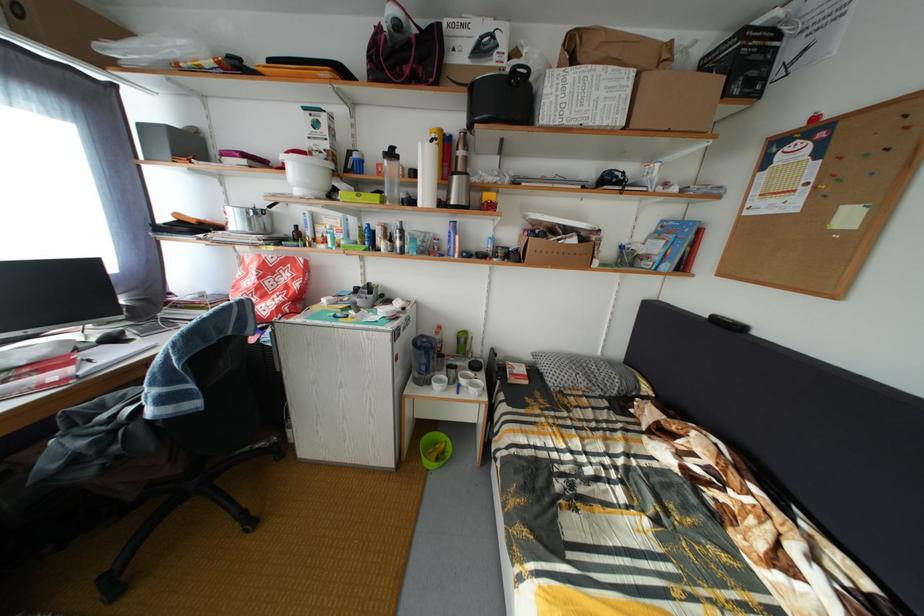
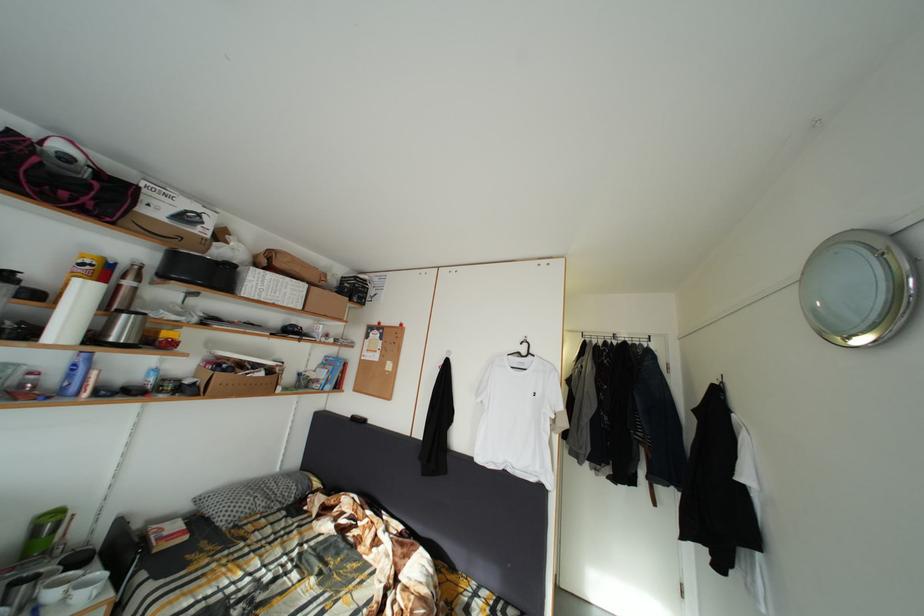
Based on the continuous images, in which direction is the camera rotating?

The camera rotated toward right-up.